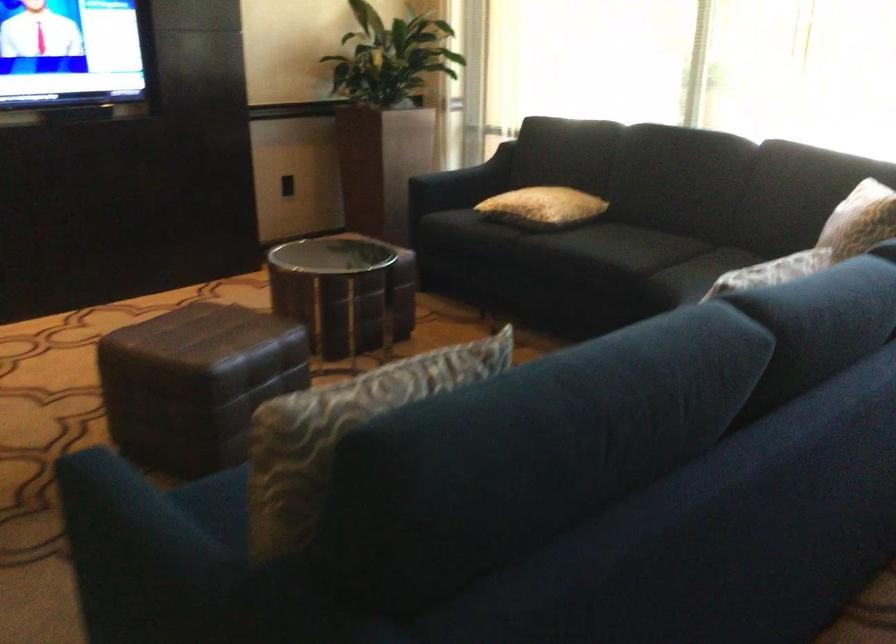
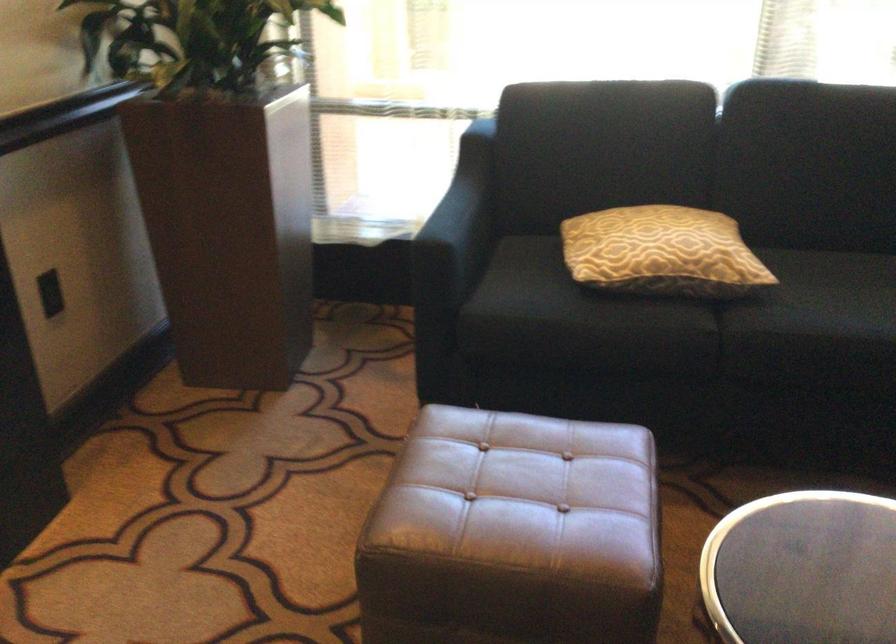
In the second image, find the point that corresponds to (x=443, y=175) in the first image.

(458, 225)